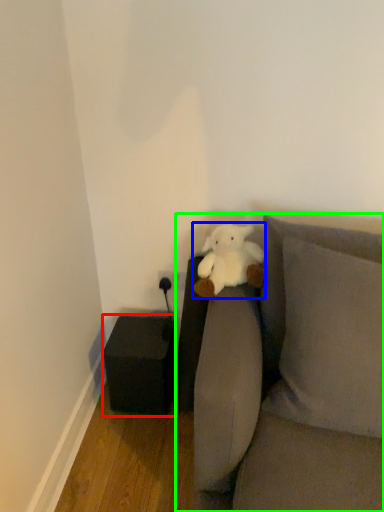
Question: Estimate the real-world distances between objects in this image. Which object is farther from furniture (highlighted by a red box), teddy bear (highlighted by a blue box) or studio couch (highlighted by a green box)?

Choices:
 (A) teddy bear
 (B) studio couch

Answer: (B)